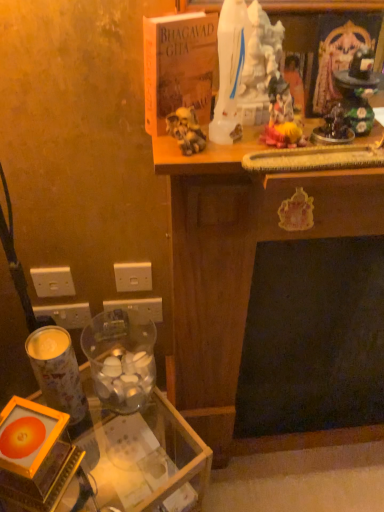
Question: Considering the relative positions of hardcover bhagavad gita at upper center and metallic cylindrical candle holder at lower left, the second candle holder in the right-to-left sequence, in the image provided, is hardcover bhagavad gita at upper center to the right of metallic cylindrical candle holder at lower left, the second candle holder in the right-to-left sequence, from the viewer's perspective?

Choices:
 (A) no
 (B) yes

Answer: (B)

Question: Considering the relative sizes of hardcover bhagavad gita at upper center and metallic cylindrical candle holder at lower left, the second candle holder in the right-to-left sequence, in the image provided, is hardcover bhagavad gita at upper center shorter than metallic cylindrical candle holder at lower left, the second candle holder in the right-to-left sequence,?

Choices:
 (A) no
 (B) yes

Answer: (B)

Question: Considering the relative positions of hardcover bhagavad gita at upper center and metallic cylindrical candle holder at lower left, placed as the first candle holder when sorted from left to right, in the image provided, is hardcover bhagavad gita at upper center behind metallic cylindrical candle holder at lower left, placed as the first candle holder when sorted from left to right,?

Choices:
 (A) no
 (B) yes

Answer: (A)

Question: Considering the relative positions of hardcover bhagavad gita at upper center and metallic cylindrical candle holder at lower left, the second candle holder in the right-to-left sequence, in the image provided, is hardcover bhagavad gita at upper center to the left of metallic cylindrical candle holder at lower left, the second candle holder in the right-to-left sequence, from the viewer's perspective?

Choices:
 (A) no
 (B) yes

Answer: (A)

Question: From a real-world perspective, is hardcover bhagavad gita at upper center over metallic cylindrical candle holder at lower left, the second candle holder in the right-to-left sequence?

Choices:
 (A) yes
 (B) no

Answer: (A)

Question: From a real-world perspective, relative to white plastic electric outlet at lower left, placed as the 1th electric outlet when sorted from left to right, is hardcover bhagavad gita at upper center vertically above or below?

Choices:
 (A) above
 (B) below

Answer: (A)

Question: Based on their positions, is hardcover bhagavad gita at upper center located to the left or right of white plastic electric outlet at lower left, the fourth electric outlet when ordered from right to left?

Choices:
 (A) left
 (B) right

Answer: (B)

Question: In the image, is hardcover bhagavad gita at upper center positioned in front of or behind white plastic electric outlet at lower left, the fourth electric outlet when ordered from right to left?

Choices:
 (A) front
 (B) behind

Answer: (A)

Question: From their relative heights in the image, would you say hardcover bhagavad gita at upper center is taller or shorter than white plastic electric outlet at lower left, the fourth electric outlet when ordered from right to left?

Choices:
 (A) short
 (B) tall

Answer: (B)

Question: From the image's perspective, is white plastic electric outlet at lower left, the 2th electric outlet from the left, located above or below white plastic electric outlet at lower left, which appears as the first electric outlet when viewed from the right?

Choices:
 (A) above
 (B) below

Answer: (B)

Question: Would you say white plastic electric outlet at lower left, the 2th electric outlet from the left, is to the left or to the right of white plastic electric outlet at lower left, which appears as the first electric outlet when viewed from the right, in the picture?

Choices:
 (A) left
 (B) right

Answer: (A)

Question: Looking at the image, does white plastic electric outlet at lower left, the 2th electric outlet from the left, seem bigger or smaller compared to white plastic electric outlet at lower left, which appears as the first electric outlet when viewed from the right?

Choices:
 (A) small
 (B) big

Answer: (A)

Question: Do you think white plastic electric outlet at lower left, the 3th electric outlet viewed from the right, is within white plastic electric outlet at lower left, acting as the fourth electric outlet starting from the left, or outside of it?

Choices:
 (A) outside
 (B) inside

Answer: (A)

Question: Based on their sizes in the image, would you say white plastic electric outlet at lower left, placed as the 1th electric outlet when sorted from left to right, is bigger or smaller than white plastic electric outlet at lower left, which appears as the first electric outlet when viewed from the right?

Choices:
 (A) big
 (B) small

Answer: (A)

Question: Would you say white plastic electric outlet at lower left, the fourth electric outlet when ordered from right to left, is to the left or to the right of white plastic electric outlet at lower left, which appears as the first electric outlet when viewed from the right, in the picture?

Choices:
 (A) right
 (B) left

Answer: (B)